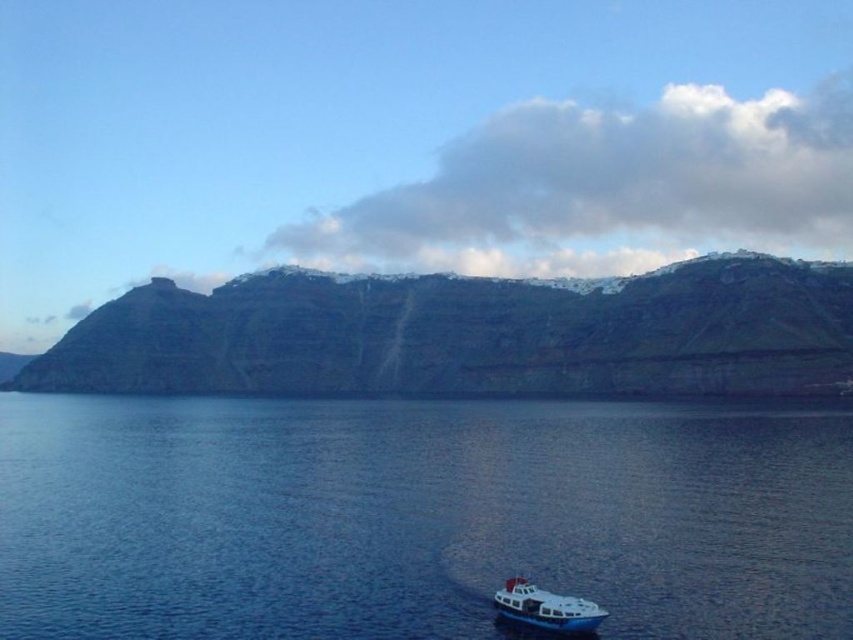
Is rugged stone cliff at upper center bigger than white glossy boat at lower left?

Correct, rugged stone cliff at upper center is larger in size than white glossy boat at lower left.

Can you confirm if rugged stone cliff at upper center is smaller than white glossy boat at lower left?

No, rugged stone cliff at upper center is not smaller than white glossy boat at lower left.

Does point (349, 304) lie in front of point (546, 595)?

No, it is not.

You are a GUI agent. You are given a task and a screenshot of the screen. Output one action in this format:
    pyautogui.click(x=<x>, y=<y>)
    Task: Click on the rugged stone cliff at upper center
    The width and height of the screenshot is (853, 640).
    Given the screenshot: What is the action you would take?
    pyautogui.click(x=469, y=333)

Which is more to the left, blue liquid water at lower center or rugged stone cliff at upper center?

rugged stone cliff at upper center

Is blue liquid water at lower center below rugged stone cliff at upper center?

Yes, blue liquid water at lower center is below rugged stone cliff at upper center.

Between point (347, 461) and point (714, 346), which one is positioned in front?

Positioned in front is point (347, 461).

Where is `blue liquid water at lower center`? blue liquid water at lower center is located at coordinates (418, 516).

Does blue liquid water at lower center have a lesser width compared to white glossy boat at lower left?

Incorrect, blue liquid water at lower center's width is not less than white glossy boat at lower left's.

Does blue liquid water at lower center appear on the right side of white glossy boat at lower left?

Incorrect, blue liquid water at lower center is not on the right side of white glossy boat at lower left.

Does point (585, 579) come farther from viewer compared to point (589, 609)?

Yes, it is behind point (589, 609).

This screenshot has width=853, height=640. What are the coordinates of `blue liquid water at lower center` in the screenshot? It's located at (418, 516).